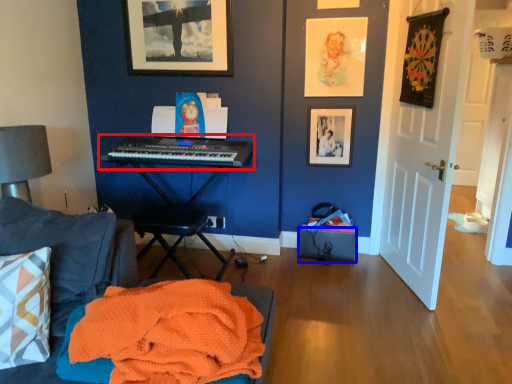
Question: Which of the following is the farthest to the observer, musical keyboard (highlighted by a red box) or box (highlighted by a blue box)?

Choices:
 (A) musical keyboard
 (B) box

Answer: (B)